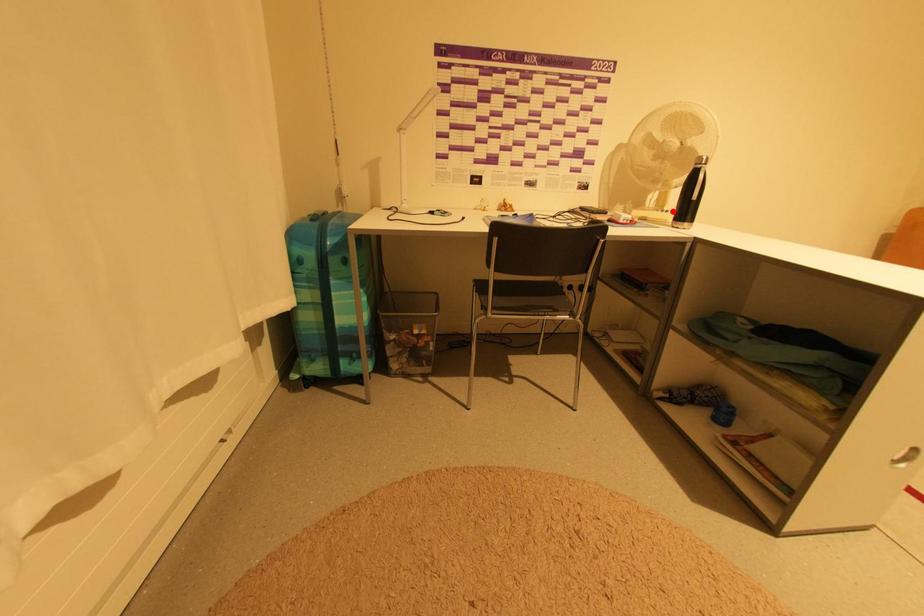
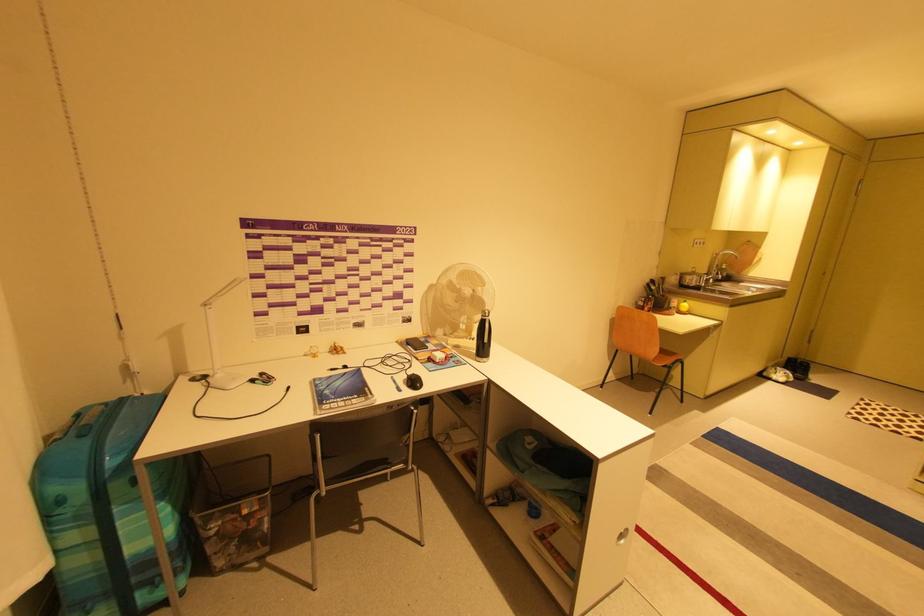
In the second image, find the point that corresponds to the highlighted location in the first image.

(479, 339)